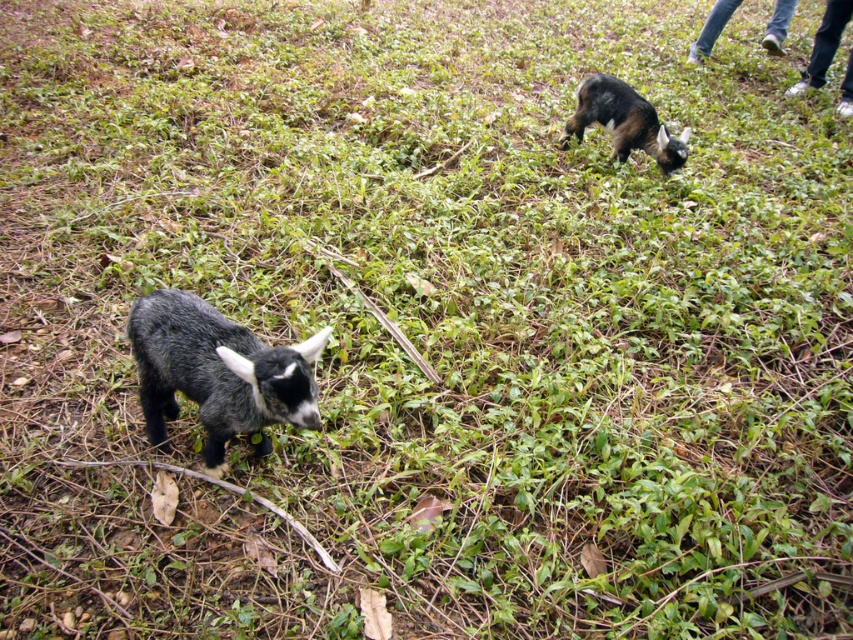
Between dark brown fur goat at upper right and white fabric pants at upper right, which one is positioned lower?

Positioned lower is dark brown fur goat at upper right.

Is dark brown fur goat at upper right bigger than white fabric pants at upper right?

Actually, dark brown fur goat at upper right might be smaller than white fabric pants at upper right.

Who is more distant from viewer, [659,161] or [850,90]?

The point [850,90] is behind.

This screenshot has width=853, height=640. What are the coordinates of `dark brown fur goat at upper right` in the screenshot? It's located at (624, 122).

Between shiny black goat at lower left and blue jeans at upper right, which one appears on the right side from the viewer's perspective?

Positioned to the right is blue jeans at upper right.

Between shiny black goat at lower left and blue jeans at upper right, which one has less height?

With less height is shiny black goat at lower left.

Is point (144, 304) closer to camera compared to point (782, 4)?

Yes, it is in front of point (782, 4).

This screenshot has height=640, width=853. In order to click on shiny black goat at lower left in this screenshot , I will do `click(218, 372)`.

Is white fabric pants at upper right to the left of blue jeans at upper right from the viewer's perspective?

In fact, white fabric pants at upper right is to the right of blue jeans at upper right.

Does white fabric pants at upper right have a lesser height compared to blue jeans at upper right?

In fact, white fabric pants at upper right may be taller than blue jeans at upper right.

Find the location of a particular element. This screenshot has width=853, height=640. white fabric pants at upper right is located at coordinates (822, 45).

The height and width of the screenshot is (640, 853). Find the location of `white fabric pants at upper right`. white fabric pants at upper right is located at coordinates (822, 45).